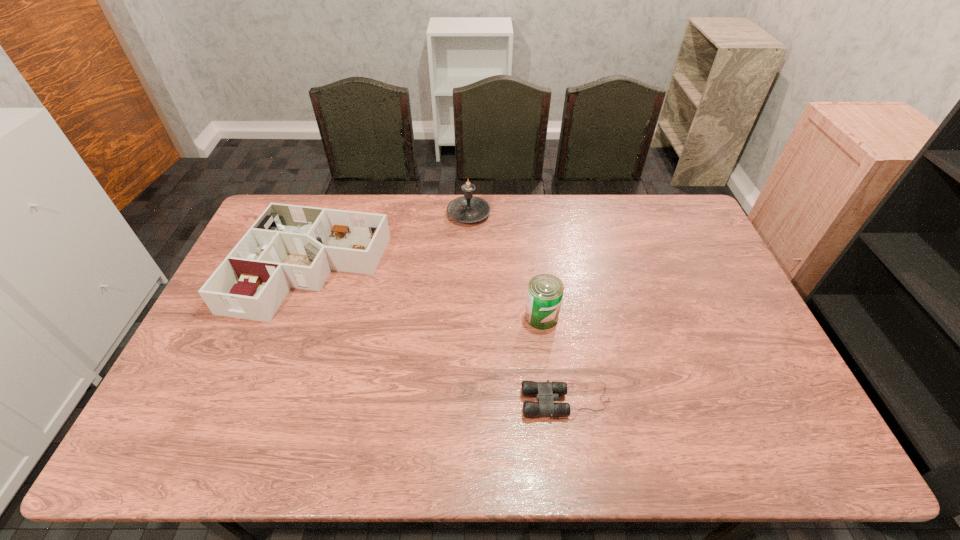
Choose which object is the second nearest neighbor to the candle. Please provide its 2D coordinates. Your answer should be formatted as a tuple, i.e. [(x, y)], where the tuple contains the x and y coordinates of a point satisfying the conditions above.

[(545, 292)]

The height and width of the screenshot is (540, 960). Identify the location of object that is the nearest to the second object from left to right. (289, 246).

You are a GUI agent. You are given a task and a screenshot of the screen. Output one action in this format:
    pyautogui.click(x=<x>, y=<y>)
    Task: Click on the free space in the image that satisfies the following two spatial constraints: 1. on the front side of the second object from left to right; 2. on the left side of the second tallest object
    
    Given the screenshot: What is the action you would take?
    pyautogui.click(x=466, y=316)

In order to click on blank space that satisfies the following two spatial constraints: 1. on the front side of the third shortest object; 2. on the left side of the second shortest object in this screenshot , I will do `click(293, 316)`.

Find the location of a particular element. The image size is (960, 540). blank area in the image that satisfies the following two spatial constraints: 1. on the back side of the leftmost object; 2. on the left side of the candle is located at coordinates (331, 214).